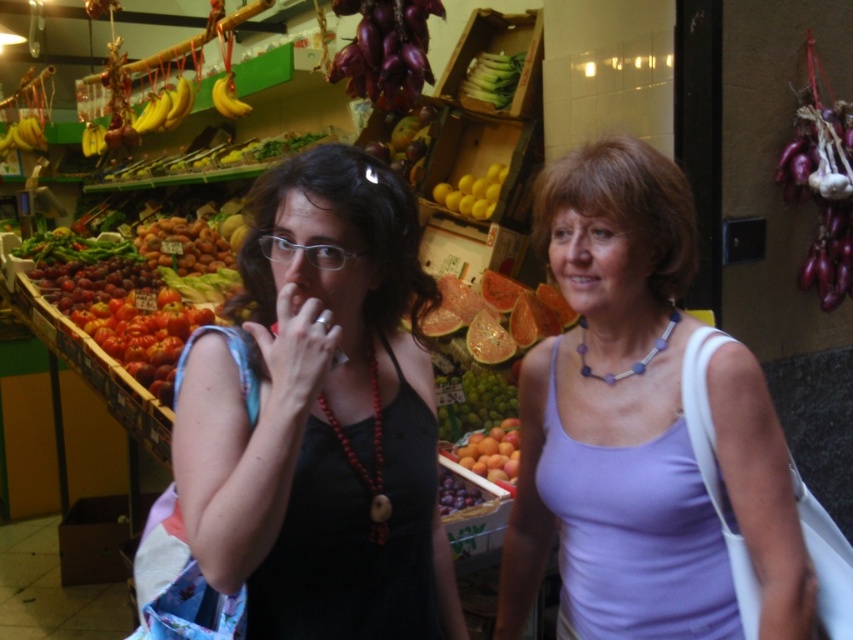
Who is more distant from viewer, (838, 189) or (465, 198)?

The point (465, 198) is behind.

From the picture: Who is positioned more to the left, purple glossy eggplant at upper right or yellow matte lemons at center?

From the viewer's perspective, yellow matte lemons at center appears more on the left side.

Is point (828, 170) farther from camera compared to point (485, 193)?

No, (828, 170) is closer to viewer.

Identify the location of purple glossy eggplant at upper right. This screenshot has height=640, width=853. pos(822,192).

Does ripe yellow apricots at center have a larger size compared to smooth orange peaches at center?

Yes.

Does ripe yellow apricots at center have a lesser height compared to smooth orange peaches at center?

No.

Consider the image. Measure the distance between point (196, 236) and camera.

Point (196, 236) and camera are 14.31 feet apart.

This screenshot has width=853, height=640. Identify the location of ripe yellow apricots at center. (183, 244).

Is ripe red tomato at center to the left of smooth orange peaches at center from the viewer's perspective?

Yes, ripe red tomato at center is to the left of smooth orange peaches at center.

Who is more distant from viewer, (173, 301) or (515, 458)?

The point (173, 301) is behind.

Locate an element on the screen. The width and height of the screenshot is (853, 640). ripe red tomato at center is located at coordinates (144, 336).